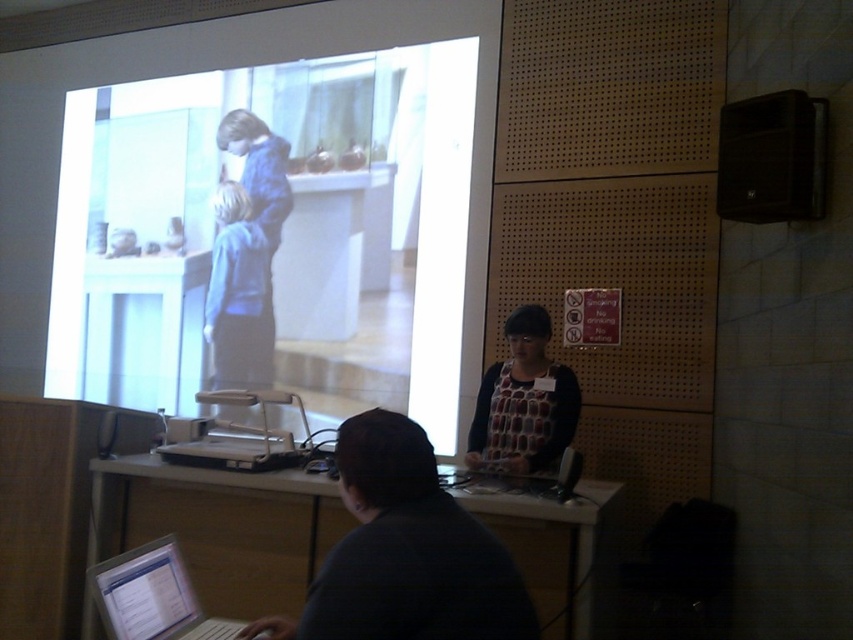
Is white glossy screen at upper center above white glossy table at lower center?

Yes.

Who is shorter, white glossy screen at upper center or white glossy table at lower center?

white glossy table at lower center

Identify the location of white glossy screen at upper center. (280, 221).

This screenshot has height=640, width=853. In order to click on white glossy screen at upper center in this screenshot , I will do `click(280, 221)`.

Does white glossy screen at upper center lie in front of polka dot blouse at center?

No, white glossy screen at upper center is behind polka dot blouse at center.

Can you confirm if white glossy screen at upper center is positioned to the left of polka dot blouse at center?

Indeed, white glossy screen at upper center is positioned on the left side of polka dot blouse at center.

Is point (358, 275) behind point (465, 461)?

Yes.

Where is `white glossy screen at upper center`? white glossy screen at upper center is located at coordinates (280, 221).

Is polka dot blouse at center shorter than silver metallic laptop at lower left?

No.

Is polka dot blouse at center thinner than silver metallic laptop at lower left?

Incorrect, polka dot blouse at center's width is not less than silver metallic laptop at lower left's.

Describe the element at coordinates (524, 401) in the screenshot. I see `polka dot blouse at center` at that location.

Where is `polka dot blouse at center`? polka dot blouse at center is located at coordinates (524, 401).